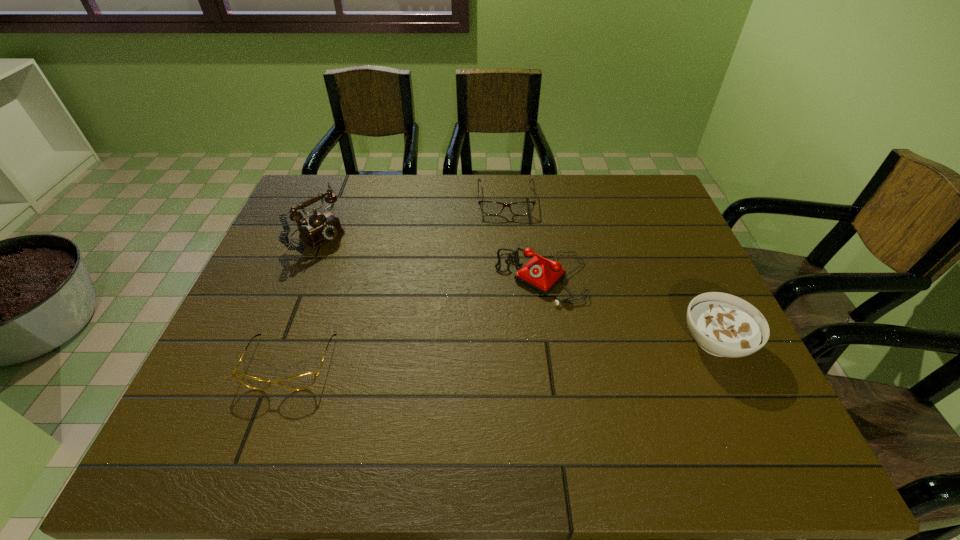
Image resolution: width=960 pixels, height=540 pixels. Identify the location of vacant space located 0.100m on the dial of the tallest object. (355, 259).

Identify the location of free space located on the dial of the tallest object. Image resolution: width=960 pixels, height=540 pixels. (360, 262).

Locate an element on the screen. Image resolution: width=960 pixels, height=540 pixels. vacant space located on the dial of the tallest object is located at coordinates (360, 262).

Image resolution: width=960 pixels, height=540 pixels. I want to click on vacant region located 0.340m on the dial of the shorter telephone, so (x=420, y=394).

Locate an element on the screen. Image resolution: width=960 pixels, height=540 pixels. free location located 0.270m on the dial of the shorter telephone is located at coordinates (443, 372).

At what (x,y) coordinates should I click in order to perform the action: click on blank area located on the dial of the shorter telephone. Please return your answer as a coordinate pair (x, y). Looking at the image, I should click on coord(474,340).

This screenshot has height=540, width=960. Identify the location of spectacles located at the far edge. (487, 207).

I want to click on telephone at the far edge, so click(320, 227).

You are a GUI agent. You are given a task and a screenshot of the screen. Output one action in this format:
    pyautogui.click(x=<x>, y=<y>)
    Task: Click on the object that is at the near edge
    
    Given the screenshot: What is the action you would take?
    pyautogui.click(x=302, y=381)

Identify the location of spectacles positioned at the left edge. (302, 381).